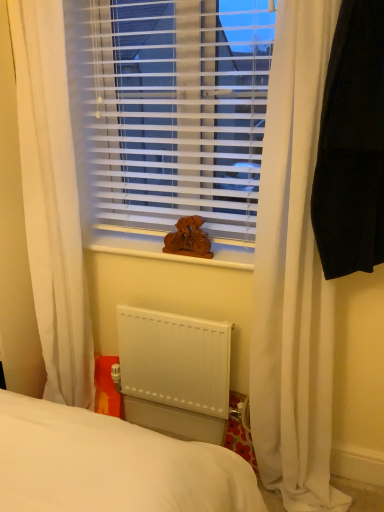
Locate an element on the screen. The image size is (384, 512). vacant space underneath white plastic blinds at center (from a real-world perspective) is located at coordinates (137, 242).